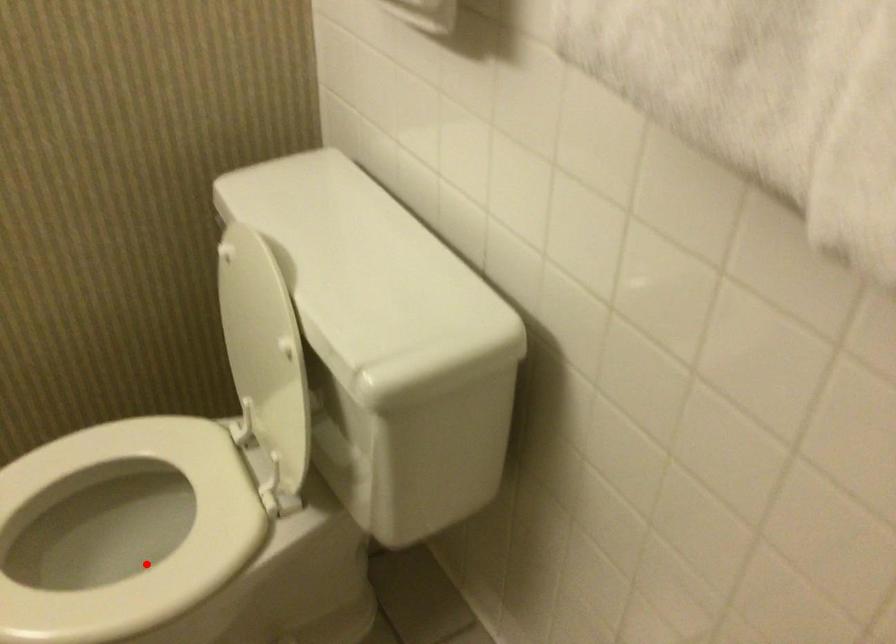
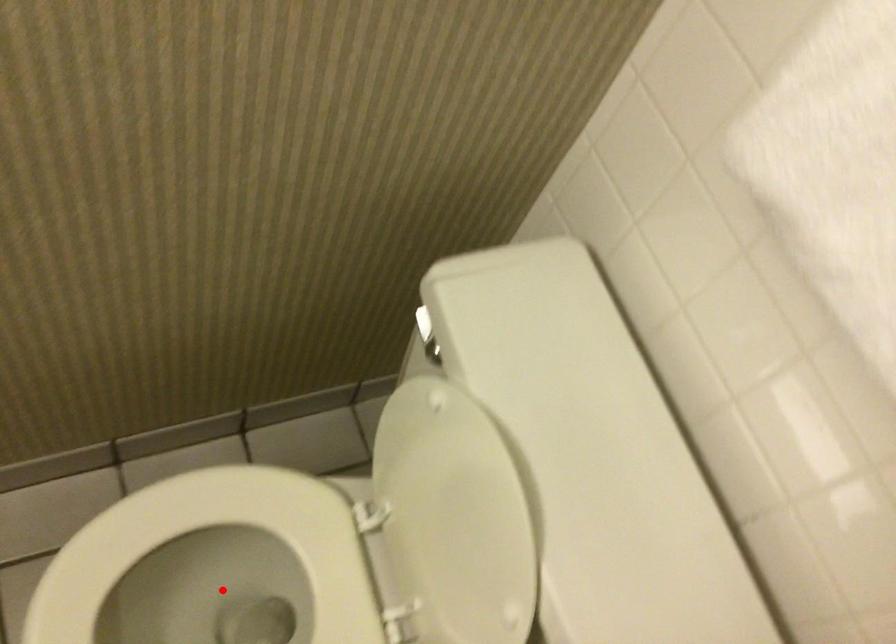
I am providing you with two images of the same scene from different viewpoints. A red point is marked on the first image and another point is marked on the second image. Does the point marked in image1 correspond to the same location as the one in image2?

Yes